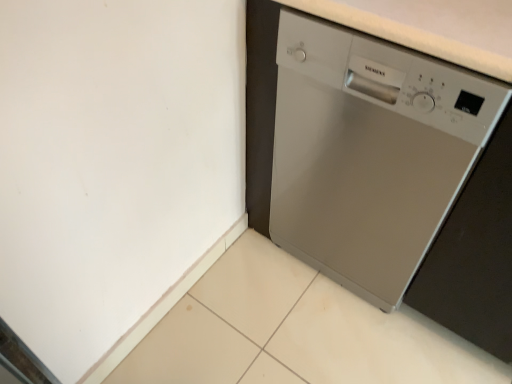
Identify the location of satin silver dishwasher at right. This screenshot has width=512, height=384. (369, 153).

This screenshot has height=384, width=512. Describe the element at coordinates (369, 153) in the screenshot. I see `satin silver dishwasher at right` at that location.

Identify the location of satin silver dishwasher at right. This screenshot has height=384, width=512. (369, 153).